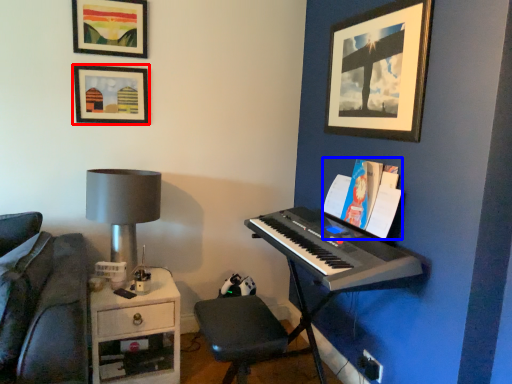
Question: Which object is closer to the camera taking this photo, picture frame (highlighted by a red box) or paperback book (highlighted by a blue box)?

Choices:
 (A) picture frame
 (B) paperback book

Answer: (B)